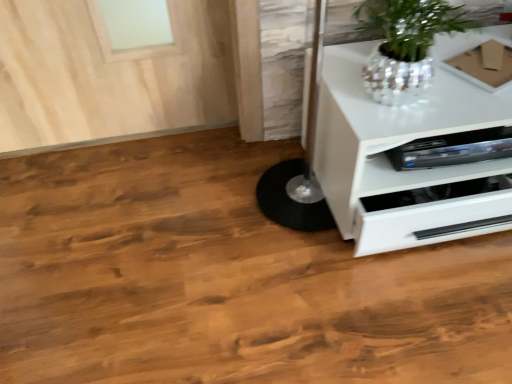
Question: Is white glossy chest of drawers at lower right to the left of brown cardboard box at upper right from the viewer's perspective?

Choices:
 (A) yes
 (B) no

Answer: (A)

Question: Is white glossy chest of drawers at lower right taller than brown cardboard box at upper right?

Choices:
 (A) no
 (B) yes

Answer: (B)

Question: Is white glossy chest of drawers at lower right turned away from brown cardboard box at upper right?

Choices:
 (A) no
 (B) yes

Answer: (A)

Question: From a real-world perspective, is white glossy chest of drawers at lower right positioned under brown cardboard box at upper right based on gravity?

Choices:
 (A) yes
 (B) no

Answer: (A)

Question: From the image's perspective, does white glossy chest of drawers at lower right appear lower than brown cardboard box at upper right?

Choices:
 (A) yes
 (B) no

Answer: (A)

Question: Which is correct: shiny metallic pot at upper right is inside white glossy chest of drawers at lower right, or outside of it?

Choices:
 (A) inside
 (B) outside

Answer: (B)

Question: Looking at their shapes, would you say shiny metallic pot at upper right is wider or thinner than white glossy chest of drawers at lower right?

Choices:
 (A) thin
 (B) wide

Answer: (A)

Question: Considering their positions, is shiny metallic pot at upper right located in front of or behind white glossy chest of drawers at lower right?

Choices:
 (A) front
 (B) behind

Answer: (A)

Question: From the image's perspective, is shiny metallic pot at upper right above or below white glossy chest of drawers at lower right?

Choices:
 (A) below
 (B) above

Answer: (B)

Question: Is shiny metallic pot at upper right taller or shorter than brown cardboard box at upper right?

Choices:
 (A) short
 (B) tall

Answer: (B)

Question: From a real-world perspective, is shiny metallic pot at upper right physically located above or below brown cardboard box at upper right?

Choices:
 (A) above
 (B) below

Answer: (A)

Question: Would you say shiny metallic pot at upper right is inside or outside brown cardboard box at upper right?

Choices:
 (A) inside
 (B) outside

Answer: (B)

Question: From the image's perspective, is shiny metallic pot at upper right above or below brown cardboard box at upper right?

Choices:
 (A) below
 (B) above

Answer: (A)

Question: Is white glossy chest of drawers at lower right taller or shorter than shiny metallic pot at upper right?

Choices:
 (A) tall
 (B) short

Answer: (A)

Question: Is point (347, 190) positioned closer to the camera than point (410, 94)?

Choices:
 (A) closer
 (B) farther

Answer: (B)